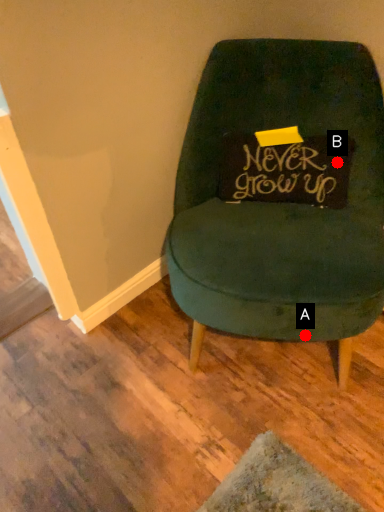
Question: Two points are circled on the image, labeled by A and B beside each circle. Which point is closer to the camera?

Choices:
 (A) A is closer
 (B) B is closer

Answer: (A)